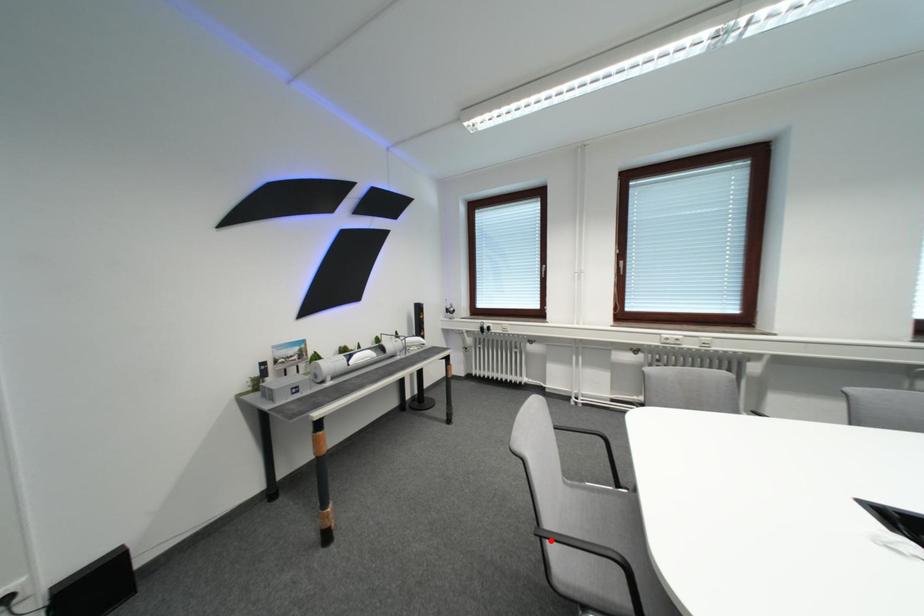
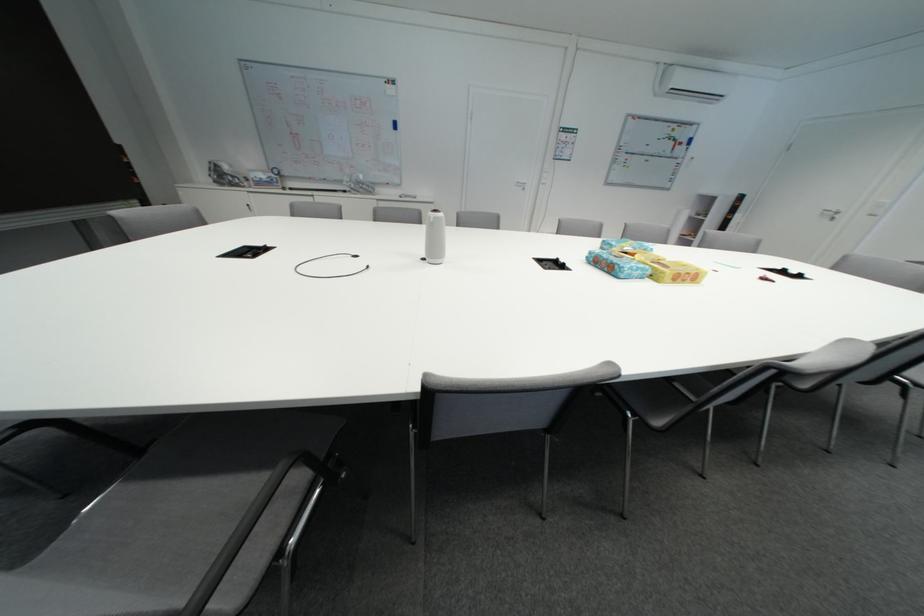
Question: I am providing you with two images of the same scene from different viewpoints. A red point is marked on the first image. Is the red point's position out of view in image 2?

Choices:
 (A) Yes
 (B) No

Answer: (A)